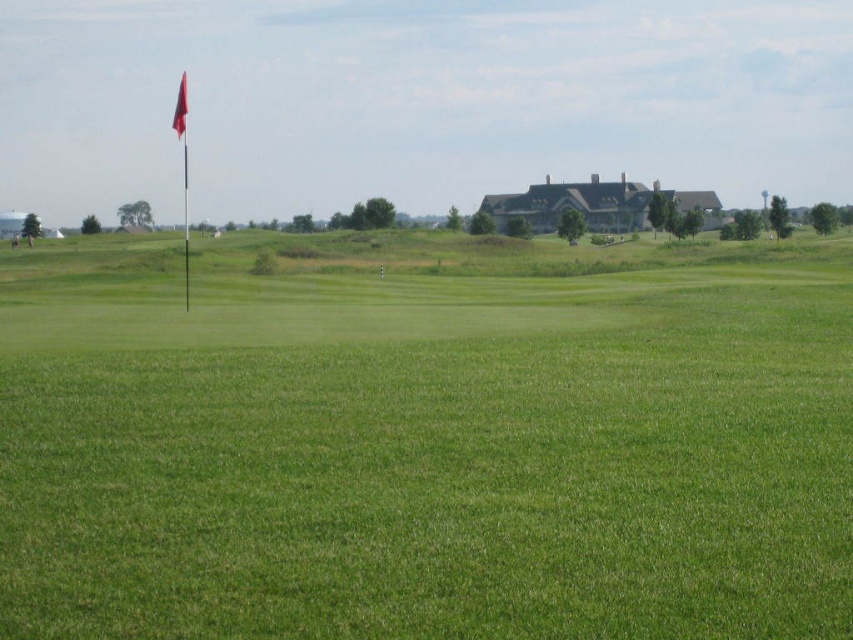
Who is positioned more to the right, metallic flag pole at upper left or red fabric flag at upper left?

metallic flag pole at upper left

Is point (183, 154) in front of point (183, 84)?

Yes, point (183, 154) is closer to viewer.

Image resolution: width=853 pixels, height=640 pixels. I want to click on metallic flag pole at upper left, so click(184, 220).

Is the position of green grass at center more distant than that of metallic flag pole at upper left?

No.

Is point (386, 506) farther from viewer compared to point (183, 184)?

No.

Identify the location of green grass at center. This screenshot has height=640, width=853. (425, 438).

Describe the element at coordinates (425, 438) in the screenshot. I see `green grass at center` at that location.

Between point (364, 605) and point (177, 104), which one is positioned behind?

The point (177, 104) is behind.

Locate an element on the screen. This screenshot has width=853, height=640. green grass at center is located at coordinates (425, 438).